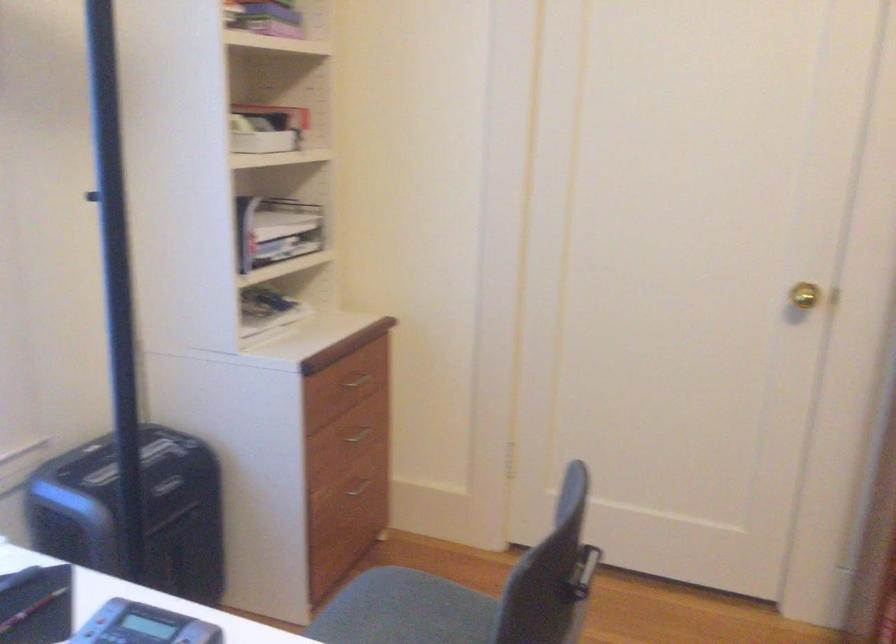
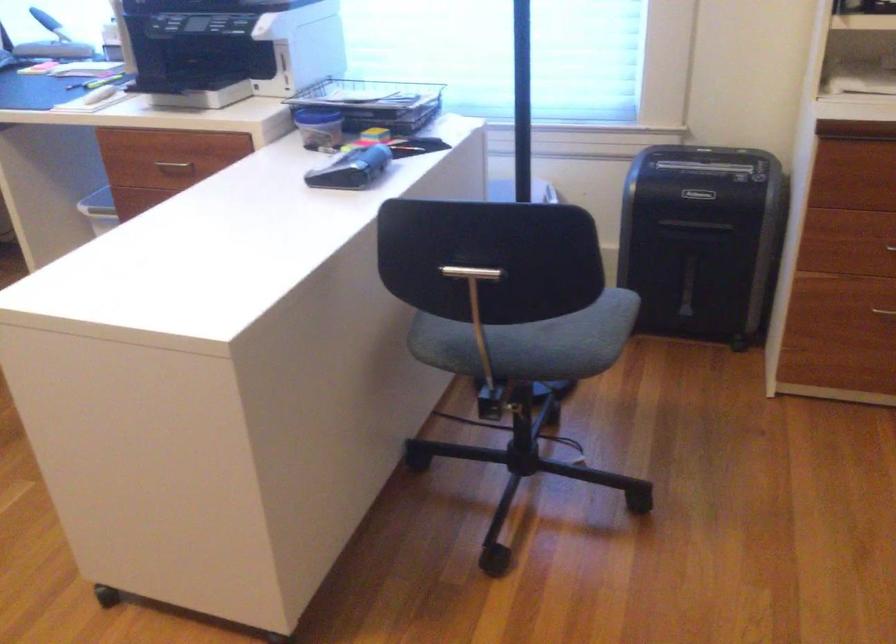
Locate, in the second image, the point that corresponds to point (369, 496) in the first image.

(883, 313)